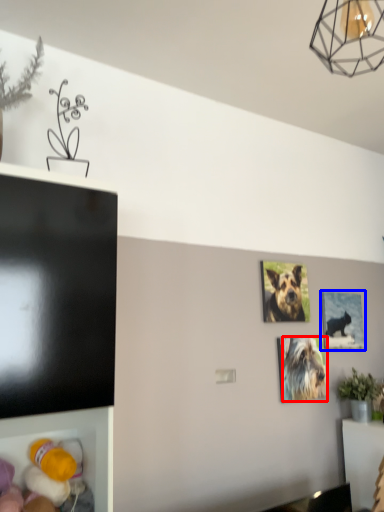
Question: Which point is further to the camera, dog (highlighted by a red box) or picture frame (highlighted by a blue box)?

Choices:
 (A) dog
 (B) picture frame

Answer: (B)